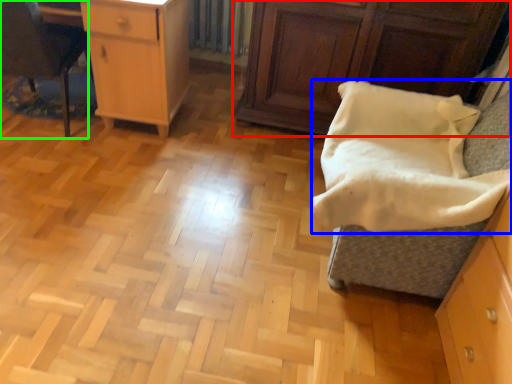
Question: Based on their relative distances, which object is nearer to cabinetry (highlighted by a red box)? Choose from blanket (highlighted by a blue box) and furniture (highlighted by a green box).

Choices:
 (A) blanket
 (B) furniture

Answer: (A)